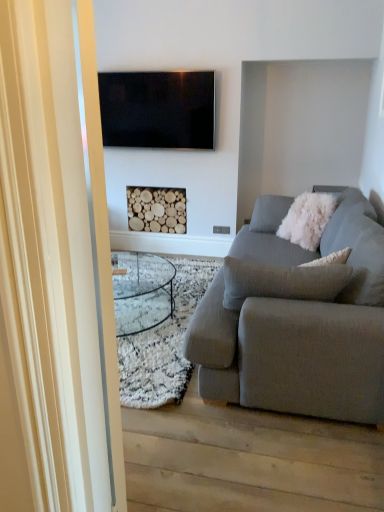
Question: From the image's perspective, is transparent glass door at left positioned above or below textured gray couch at right?

Choices:
 (A) below
 (B) above

Answer: (A)

Question: Do you think transparent glass door at left is within textured gray couch at right, or outside of it?

Choices:
 (A) inside
 (B) outside

Answer: (B)

Question: Which object is the closest to the transparent glass door at left?

Choices:
 (A) textured gray couch at right
 (B) wooden logs at center
 (C) flat screen tv at upper center
 (D) white fluffy pillow at right

Answer: (A)

Question: Which of these objects is positioned closest to the white fluffy pillow at right?

Choices:
 (A) wooden logs at center
 (B) transparent glass door at left
 (C) flat screen tv at upper center
 (D) textured gray couch at right

Answer: (D)